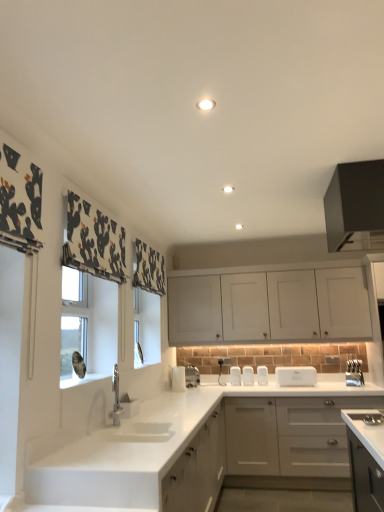
Question: Can we say black matte cabinet at upper right, the third cabinetry when ordered from bottom to top, lies outside white matte cabinet at upper center, marked as the second cabinetry in a top-to-bottom arrangement?

Choices:
 (A) no
 (B) yes

Answer: (B)

Question: Is black matte cabinet at upper right, the third cabinetry when ordered from bottom to top, positioned behind white matte cabinet at upper center, marked as the second cabinetry in a top-to-bottom arrangement?

Choices:
 (A) yes
 (B) no

Answer: (B)

Question: Is white matte cabinet at upper center, marked as the second cabinetry in a top-to-bottom arrangement, a part of black matte cabinet at upper right, the third cabinetry when ordered from bottom to top?

Choices:
 (A) yes
 (B) no

Answer: (B)

Question: From a real-world perspective, is black matte cabinet at upper right, the third cabinetry when ordered from bottom to top, located higher than white matte cabinet at upper center, which is counted as the 2th cabinetry, starting from the bottom?

Choices:
 (A) yes
 (B) no

Answer: (A)

Question: Can you confirm if black matte cabinet at upper right, the third cabinetry when ordered from bottom to top, is shorter than white matte cabinet at upper center, marked as the second cabinetry in a top-to-bottom arrangement?

Choices:
 (A) no
 (B) yes

Answer: (B)

Question: Considering the positions of white matte cabinet at upper center, marked as the second cabinetry in a top-to-bottom arrangement, and white plastic toaster at center, placed as the 5th appliance when sorted from left to right, in the image, is white matte cabinet at upper center, marked as the second cabinetry in a top-to-bottom arrangement, taller or shorter than white plastic toaster at center, placed as the 5th appliance when sorted from left to right,?

Choices:
 (A) tall
 (B) short

Answer: (A)

Question: Looking at the image, does white matte cabinet at upper center, marked as the second cabinetry in a top-to-bottom arrangement, seem bigger or smaller compared to white plastic toaster at center, placed as the 5th appliance when sorted from left to right?

Choices:
 (A) small
 (B) big

Answer: (B)

Question: Visually, is white matte cabinet at upper center, which is counted as the 2th cabinetry, starting from the bottom, positioned to the left or to the right of white plastic toaster at center, placed as the 5th appliance when sorted from left to right?

Choices:
 (A) left
 (B) right

Answer: (B)

Question: Is white matte cabinet at upper center, marked as the second cabinetry in a top-to-bottom arrangement, spatially inside white plastic toaster at center, placed as the 5th appliance when sorted from left to right, or outside of it?

Choices:
 (A) inside
 (B) outside

Answer: (B)

Question: Looking at the image, does white plastic toaster at center, which is counted as the 3th appliance, starting from the left, seem bigger or smaller compared to white plastic toaster at center, the fourth appliance when ordered from right to left?

Choices:
 (A) big
 (B) small

Answer: (A)

Question: From a real-world perspective, is white plastic toaster at center, which is counted as the 3th appliance, starting from the left, above or below white plastic toaster at center, positioned as the fourth appliance in left-to-right order?

Choices:
 (A) below
 (B) above

Answer: (A)

Question: From the image's perspective, is white plastic toaster at center, acting as the 5th appliance starting from the right, located above or below white plastic toaster at center, positioned as the fourth appliance in left-to-right order?

Choices:
 (A) below
 (B) above

Answer: (A)

Question: Is point (238, 369) closer or farther from the camera than point (246, 378)?

Choices:
 (A) farther
 (B) closer

Answer: (A)

Question: Is point (190, 387) closer or farther from the camera than point (264, 384)?

Choices:
 (A) farther
 (B) closer

Answer: (B)

Question: Considering the positions of satin nickel faucet at center, the second appliance viewed from the left, and white plastic toaster at center, placed as the 5th appliance when sorted from left to right, in the image, is satin nickel faucet at center, the second appliance viewed from the left, bigger or smaller than white plastic toaster at center, placed as the 5th appliance when sorted from left to right,?

Choices:
 (A) small
 (B) big

Answer: (B)